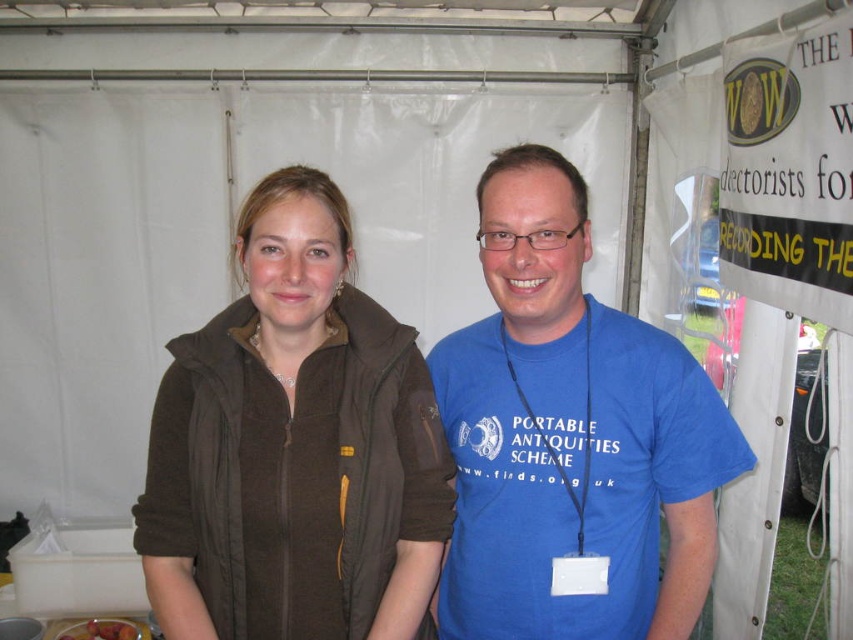
Is brown fleece jacket at center taller than blue cotton t-shirt at center?

In fact, brown fleece jacket at center may be shorter than blue cotton t-shirt at center.

Measure the distance between brown fleece jacket at center and blue cotton t-shirt at center.

21.29 centimeters

Who is more distant from viewer, (194, 465) or (618, 612)?

The point (618, 612) is behind.

I want to click on brown fleece jacket at center, so click(x=294, y=448).